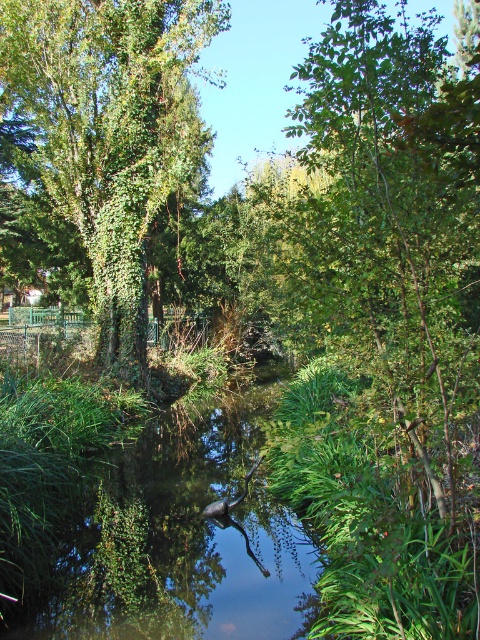
You are standing at the center of the image. Which direction should you move to reach the green leafy tree at center?

The green leafy tree at center is already at the center of the image, so you don not need to move in any direction to reach it.